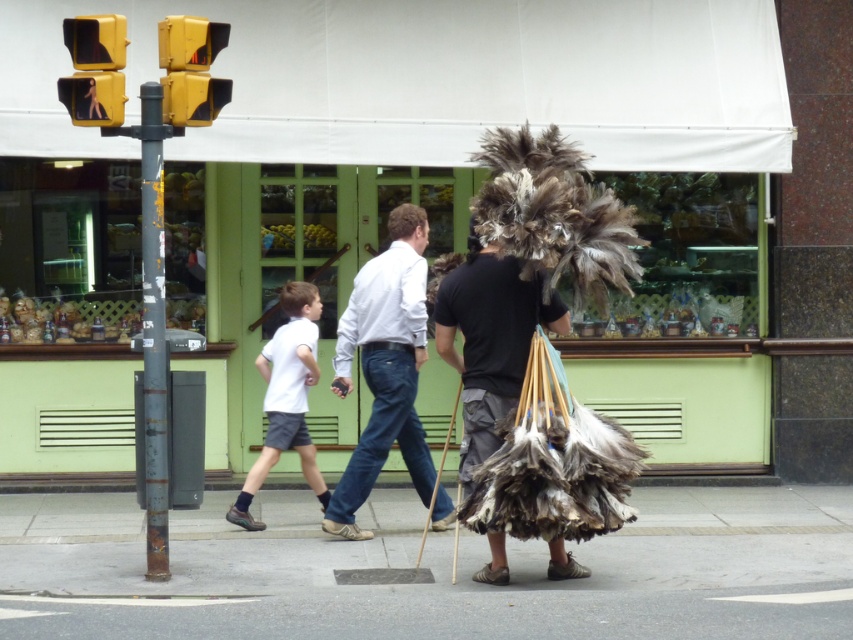
Can you confirm if feathered bundle at center is smaller than yellow matte traffic light at upper left?

No, feathered bundle at center is not smaller than yellow matte traffic light at upper left.

Does feathered bundle at center have a lesser height compared to yellow matte traffic light at upper left?

In fact, feathered bundle at center may be taller than yellow matte traffic light at upper left.

I want to click on feathered bundle at center, so click(553, 465).

Find the location of a particular element. feathered bundle at center is located at coordinates (553, 465).

From the picture: Is feathered bundle at center in front of light blue denim jeans at center?

Yes, it is in front of light blue denim jeans at center.

Is feathered bundle at center shorter than light blue denim jeans at center?

Yes, feathered bundle at center is shorter than light blue denim jeans at center.

Find the location of a particular element. This screenshot has width=853, height=640. feathered bundle at center is located at coordinates (553, 465).

Does smooth concrete sidewalk at lower center lie in front of rusty metal pole at left?

Yes, smooth concrete sidewalk at lower center is closer to the viewer.

Image resolution: width=853 pixels, height=640 pixels. What do you see at coordinates (431, 570) in the screenshot? I see `smooth concrete sidewalk at lower center` at bounding box center [431, 570].

The image size is (853, 640). I want to click on smooth concrete sidewalk at lower center, so click(431, 570).